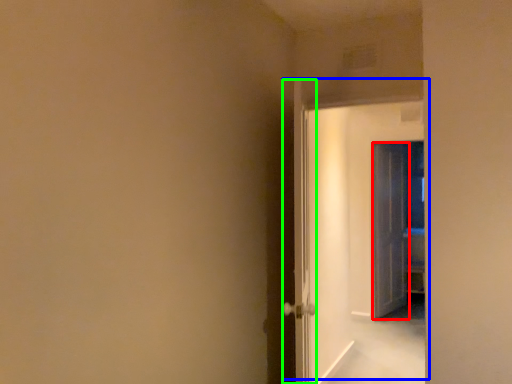
Question: Which object is positioned closest to door (highlighted by a red box)? Select from door (highlighted by a blue box) and door (highlighted by a green box).

Choices:
 (A) door
 (B) door

Answer: (A)